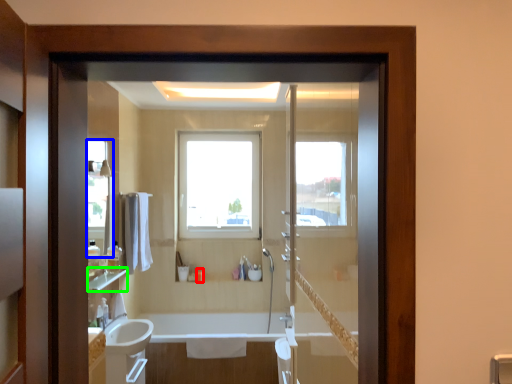
Question: Which is nearer to the toiletry (highlighted by a red box)? mirror (highlighted by a blue box) or balustrade (highlighted by a green box).

Choices:
 (A) mirror
 (B) balustrade

Answer: (B)